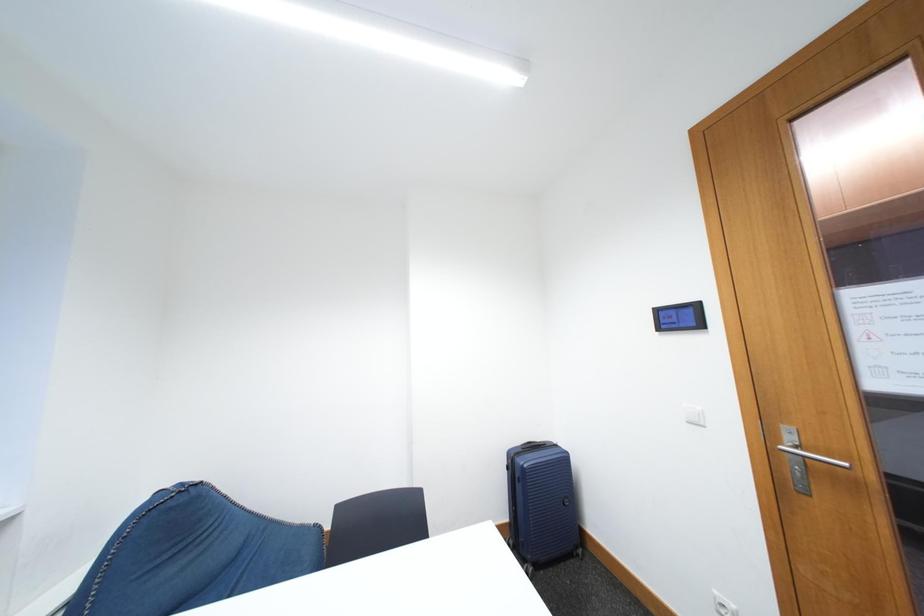
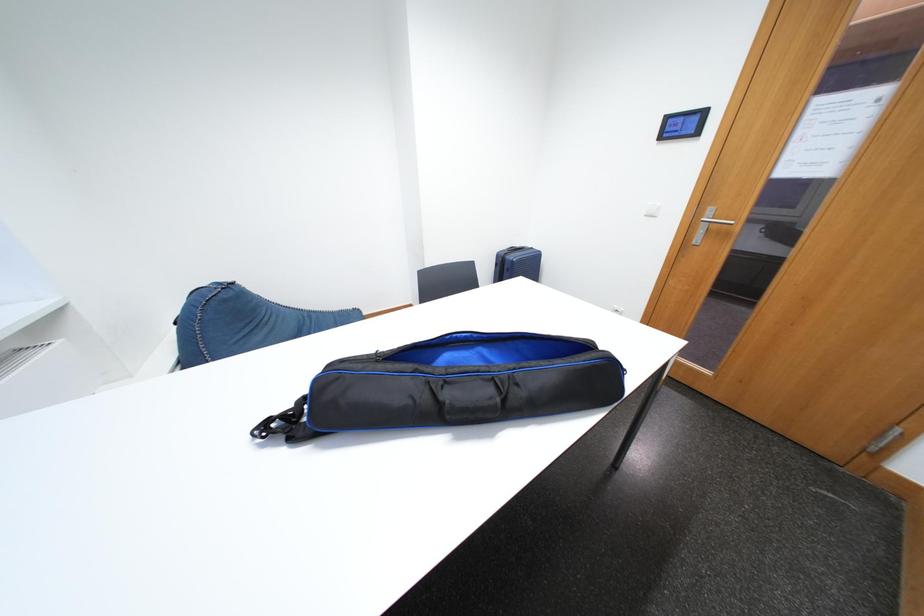
How did the camera likely rotate?

The camera's rotation is toward right-down.